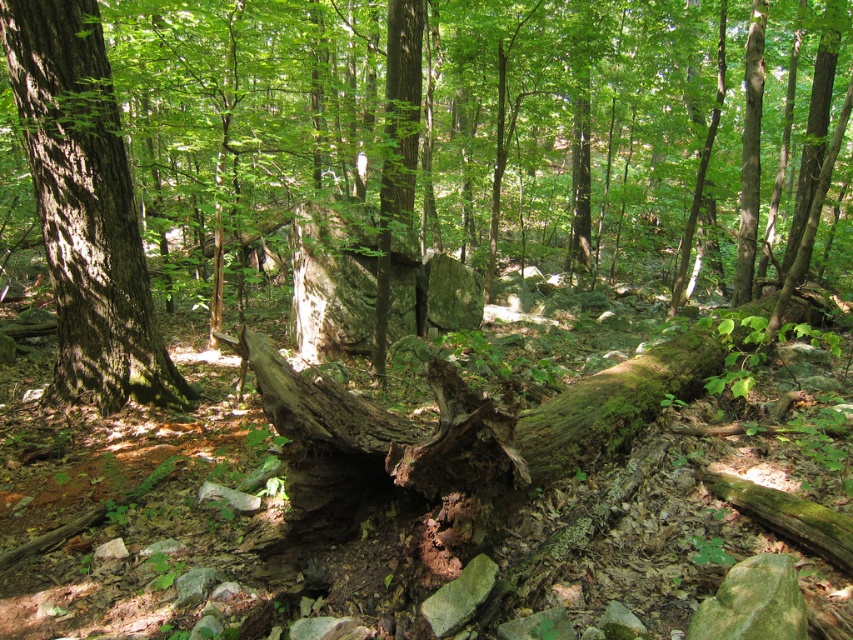
Does smooth bark tree at center have a lesser width compared to smooth brown tree trunk at left?

No, smooth bark tree at center is not thinner than smooth brown tree trunk at left.

Which is behind, point (846, 243) or point (100, 253)?

Positioned behind is point (846, 243).

Looking at this image, measure the distance between smooth bark tree at center and camera.

They are 14.16 feet apart.

Where is `smooth bark tree at center`? smooth bark tree at center is located at coordinates (471, 129).